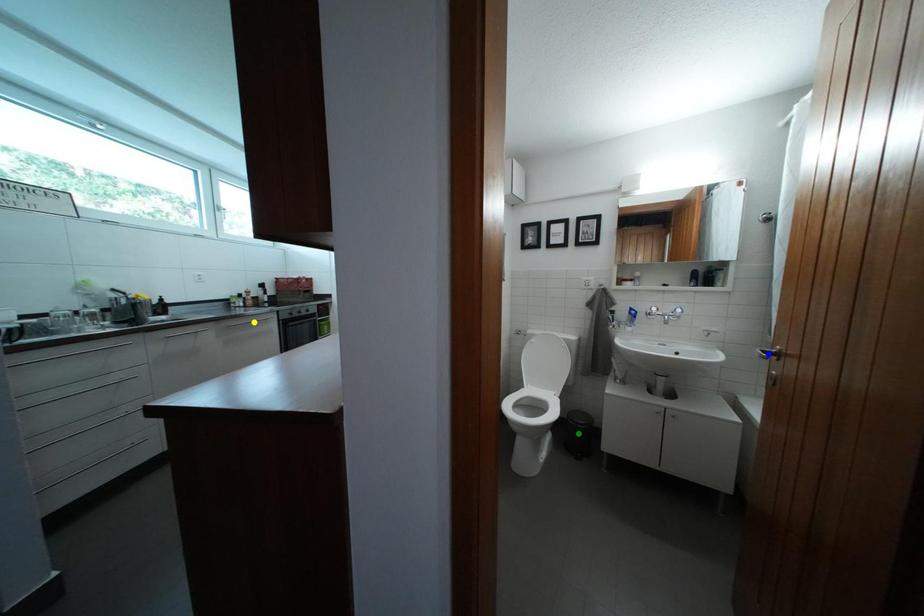
Order these from farthest to nearest:
A) green point
B) blue point
C) yellow point

yellow point, green point, blue point